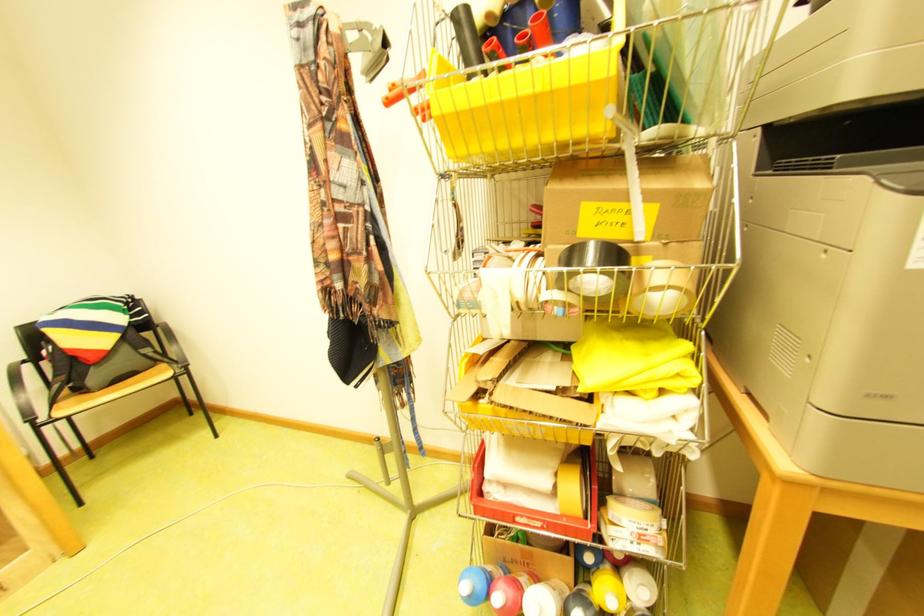
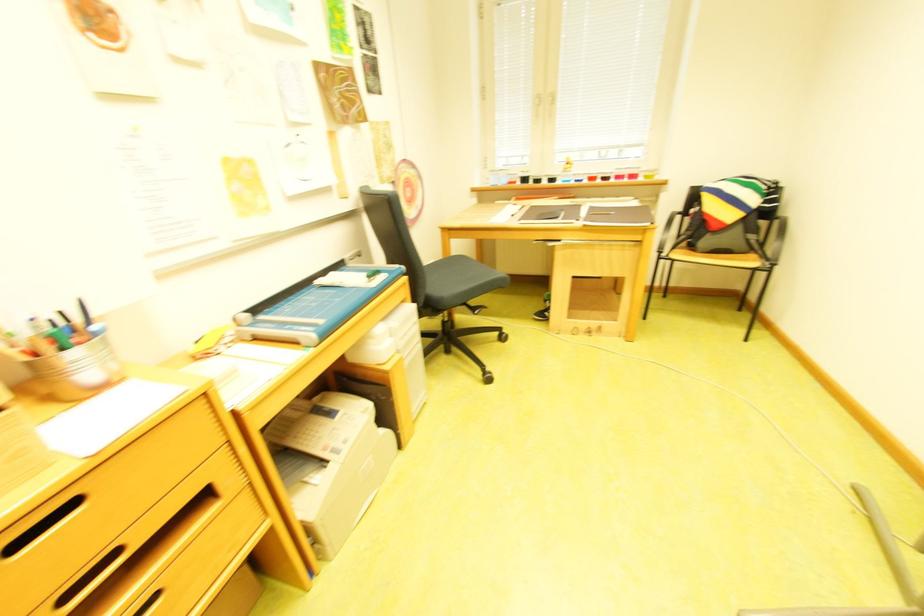
Consider the image. How did the camera likely rotate?

The camera's rotation is toward left-down.